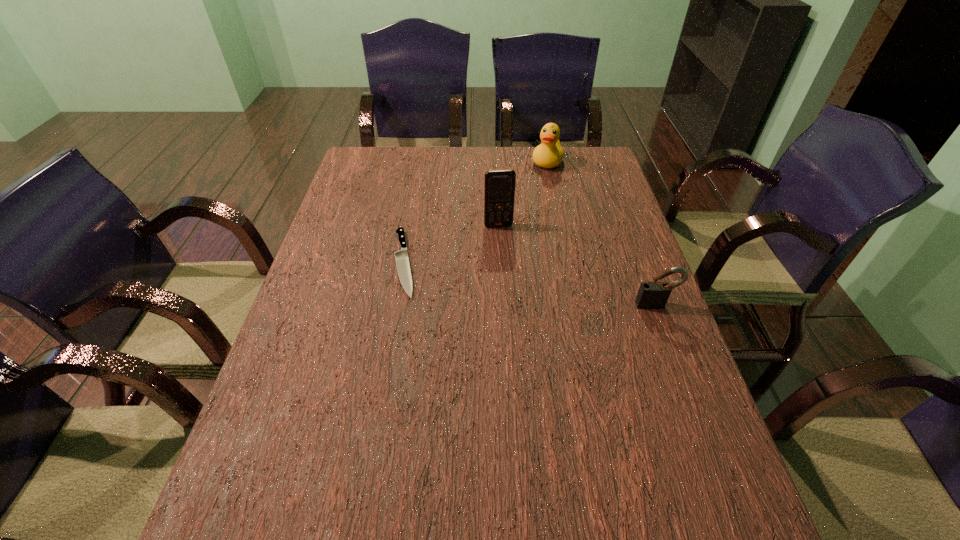
Find the location of a particular element. free space on the desktop that is between the steak knife and the third tallest object and is positioned on the screen of the second object from left to right is located at coordinates (509, 280).

Identify the location of vacant space on the desktop that is between the leftmost object and the padlock and is positioned at the beak of the third object from left to right. (492, 278).